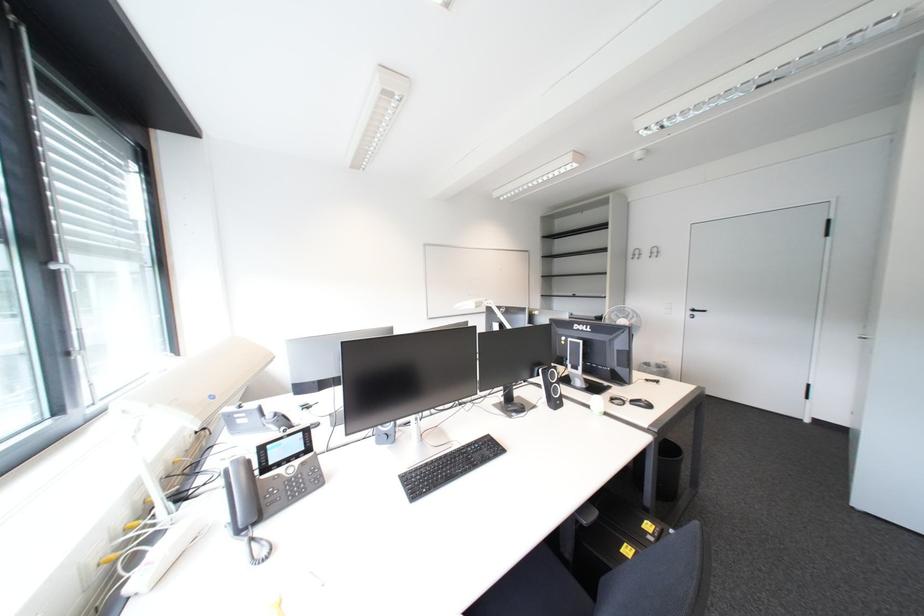
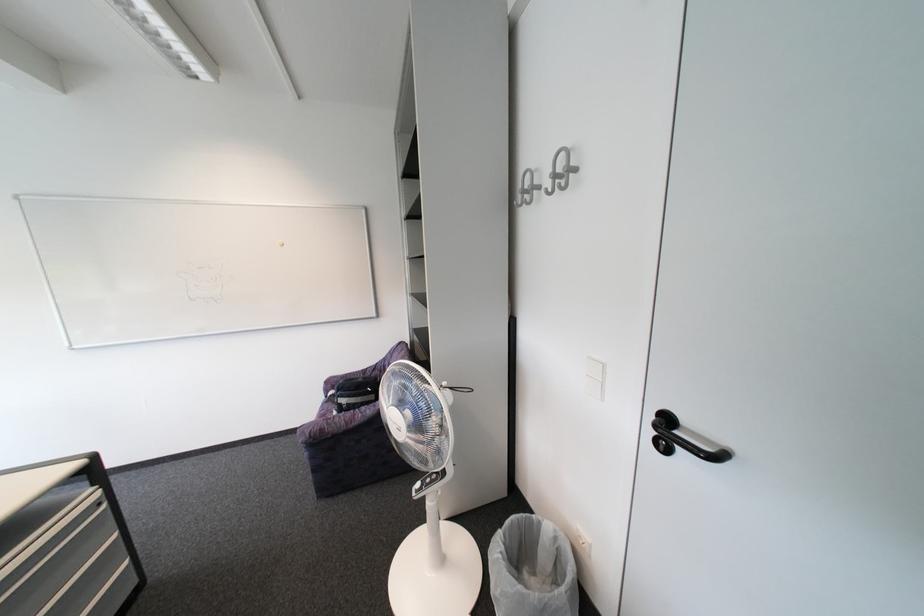
The images are taken continuously from a first-person perspective. In which direction are you moving?

The cameraman walked toward right, forward.